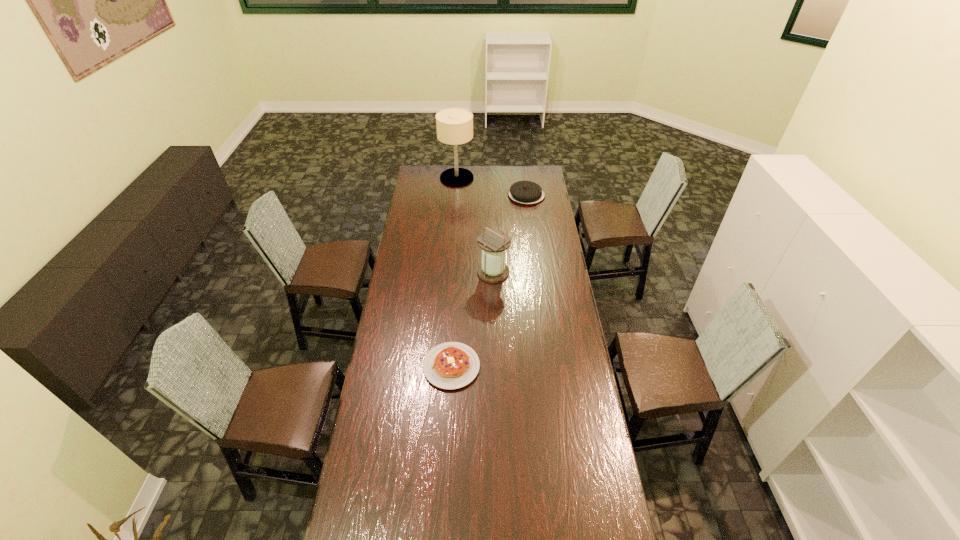
At what (x,y) coordinates should I click in order to perform the action: click on free space located on the right of the shorter pancake. Please return your answer as a coordinate pair (x, y). The width and height of the screenshot is (960, 540). Looking at the image, I should click on (540, 367).

The height and width of the screenshot is (540, 960). I want to click on table lamp located in the far edge section of the desktop, so click(454, 126).

Locate an element on the screen. pancake present at the far edge is located at coordinates (524, 192).

Image resolution: width=960 pixels, height=540 pixels. In order to click on object present at the right edge in this screenshot , I will do `click(524, 192)`.

Identify the location of object present at the far right corner. The image size is (960, 540). (524, 192).

You are a GUI agent. You are given a task and a screenshot of the screen. Output one action in this format:
    pyautogui.click(x=<x>, y=<y>)
    Task: Click on the vacant space at the far edge of the desktop
    The image size is (960, 540).
    Given the screenshot: What is the action you would take?
    pyautogui.click(x=518, y=177)

In order to click on blank space at the left edge of the desktop in this screenshot , I will do `click(421, 241)`.

You are a GUI agent. You are given a task and a screenshot of the screen. Output one action in this format:
    pyautogui.click(x=<x>, y=<y>)
    Task: Click on the vacant space at the right edge of the desktop
    This screenshot has width=960, height=540.
    Given the screenshot: What is the action you would take?
    pyautogui.click(x=541, y=255)

Find the location of `free space that is in between the table lamp and the lantern`. free space that is in between the table lamp and the lantern is located at coordinates (475, 225).

Identify the location of free space between the shorter pancake and the lantern. The height and width of the screenshot is (540, 960). (472, 319).